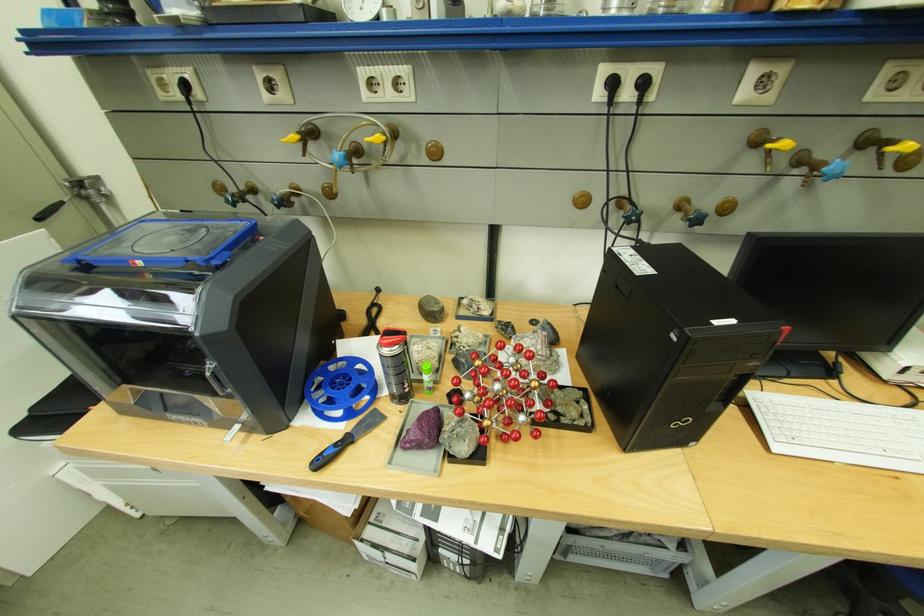
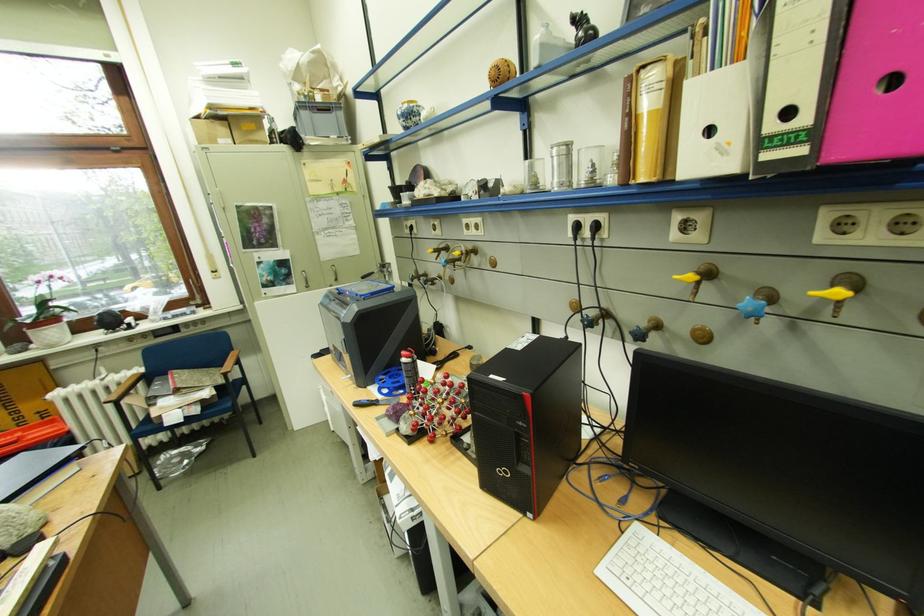
Find the pixel in the second image that matches (847,172) in the first image.

(760, 310)